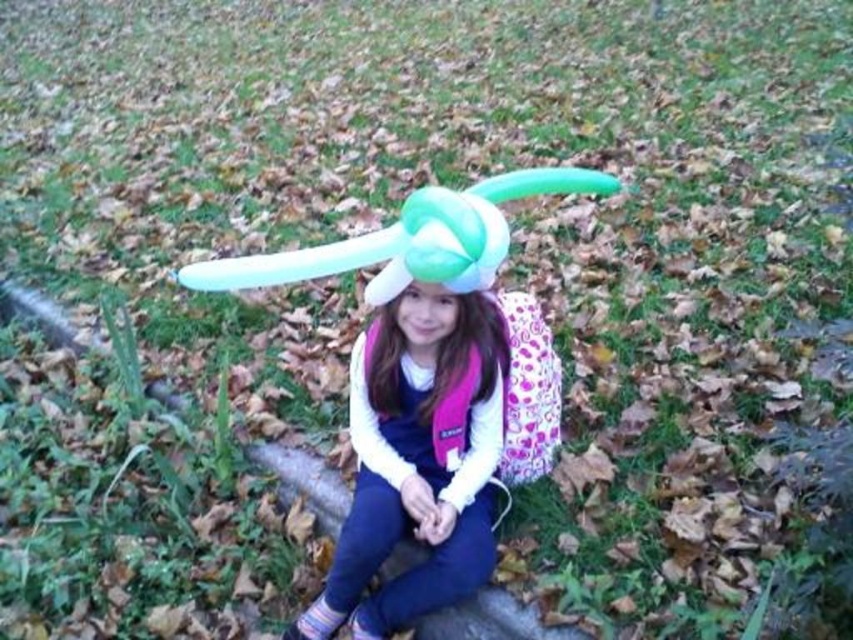
What is located at the coordinates point (416, 461) in the image?

At point (416, 461) lies a matte white balloon at center.

You are taking a photo of the girl and want to focus on both the point at point [378,330] and the point at point [424,285]. Which point should you focus on first to ensure the girl is in focus?

You should focus on point [378,330] first because it is closer to the camera than point [424,285]. Since it is closer, focusing on this point will ensure the girl is in focus.